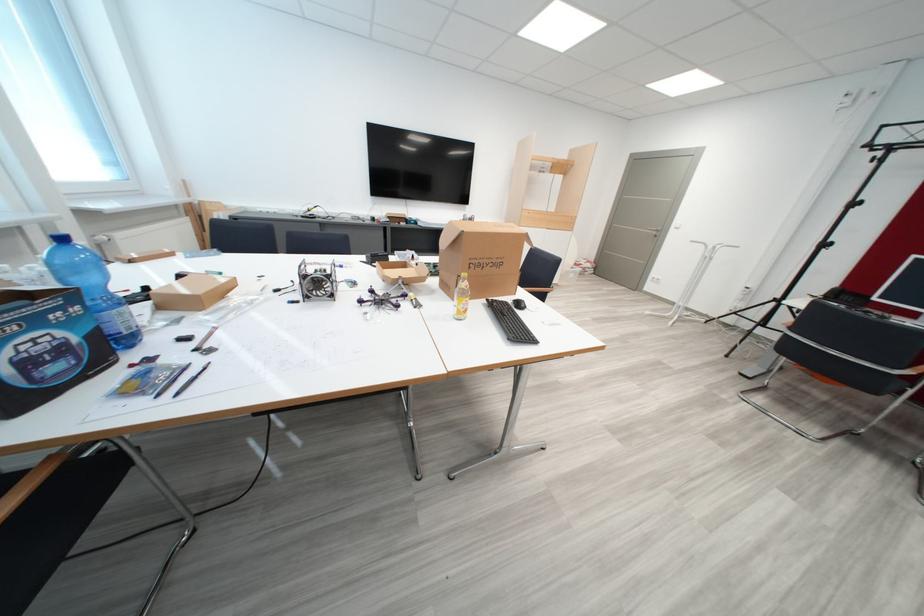
Find where to resting arm the chrome chair armrest. Please return your answer as a coordinate pair (x, y).

(882, 379)